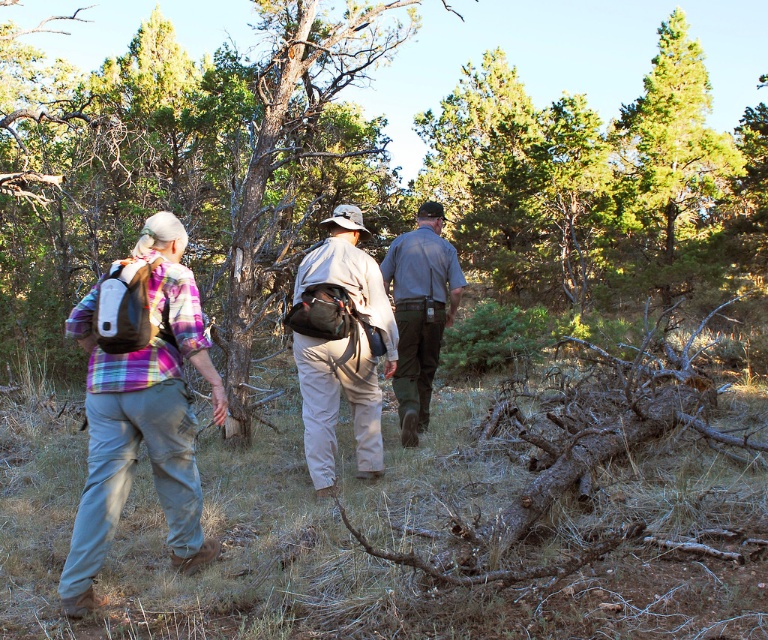
In the scene shown: Between plaid fabric shirt at center and khaki cotton pants at center, which one is positioned lower?

plaid fabric shirt at center is below.

Which is more to the left, plaid fabric shirt at center or khaki cotton pants at center?

khaki cotton pants at center

Does point (353, 381) come in front of point (376, 340)?

No, it is not.

You are a GUI agent. You are given a task and a screenshot of the screen. Output one action in this format:
    pyautogui.click(x=<x>, y=<y>)
    Task: Click on the plaid fabric shirt at center
    
    Given the screenshot: What is the action you would take?
    pyautogui.click(x=336, y=404)

Who is shorter, plaid fabric shirt at left or plaid fabric shirt at center?

plaid fabric shirt at left

Who is more distant from viewer, (194,292) or (85,570)?

The point (194,292) is more distant.

Locate an element on the screen. plaid fabric shirt at left is located at coordinates (141, 406).

The image size is (768, 640). What do you see at coordinates (336, 404) in the screenshot?
I see `plaid fabric shirt at center` at bounding box center [336, 404].

Based on the photo, does plaid fabric shirt at center have a lesser height compared to gray uniform pants at center?

Correct, plaid fabric shirt at center is not as tall as gray uniform pants at center.

Is point (91, 573) closer to camera compared to point (425, 406)?

Yes.

Locate an element on the screen. The width and height of the screenshot is (768, 640). plaid fabric shirt at center is located at coordinates (336, 404).